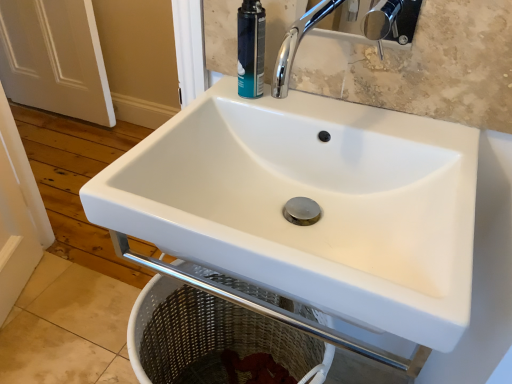
Question: Is white ceramic sink at center oriented away from teal matte shaving cream can at upper center?

Choices:
 (A) no
 (B) yes

Answer: (A)

Question: From the image's perspective, is white ceramic sink at center below teal matte shaving cream can at upper center?

Choices:
 (A) yes
 (B) no

Answer: (A)

Question: Does white ceramic sink at center have a greater height compared to teal matte shaving cream can at upper center?

Choices:
 (A) no
 (B) yes

Answer: (B)

Question: Is white ceramic sink at center bigger than teal matte shaving cream can at upper center?

Choices:
 (A) no
 (B) yes

Answer: (B)

Question: From a real-world perspective, is white ceramic sink at center below teal matte shaving cream can at upper center?

Choices:
 (A) yes
 (B) no

Answer: (A)

Question: From a real-world perspective, relative to teal matte shaving cream can at upper center, is white matte door at left vertically above or below?

Choices:
 (A) below
 (B) above

Answer: (A)

Question: Considering the positions of point (22, 84) and point (241, 26), is point (22, 84) closer or farther from the camera than point (241, 26)?

Choices:
 (A) closer
 (B) farther

Answer: (B)

Question: In terms of height, does white matte door at left look taller or shorter compared to teal matte shaving cream can at upper center?

Choices:
 (A) short
 (B) tall

Answer: (B)

Question: From the image's perspective, relative to teal matte shaving cream can at upper center, is white matte door at left above or below?

Choices:
 (A) below
 (B) above

Answer: (B)

Question: Considering their positions, is white matte door at left located in front of or behind white ceramic sink at center?

Choices:
 (A) behind
 (B) front

Answer: (A)

Question: Is white matte door at left to the left or to the right of white ceramic sink at center in the image?

Choices:
 (A) right
 (B) left

Answer: (B)

Question: Considering the positions of white matte door at left and white ceramic sink at center in the image, is white matte door at left bigger or smaller than white ceramic sink at center?

Choices:
 (A) small
 (B) big

Answer: (A)

Question: Looking at their shapes, would you say white matte door at left is wider or thinner than white ceramic sink at center?

Choices:
 (A) thin
 (B) wide

Answer: (A)

Question: Is teal matte shaving cream can at upper center spatially inside white matte door at left, or outside of it?

Choices:
 (A) outside
 (B) inside

Answer: (A)

Question: Is point (245, 11) positioned closer to the camera than point (35, 67)?

Choices:
 (A) closer
 (B) farther

Answer: (A)